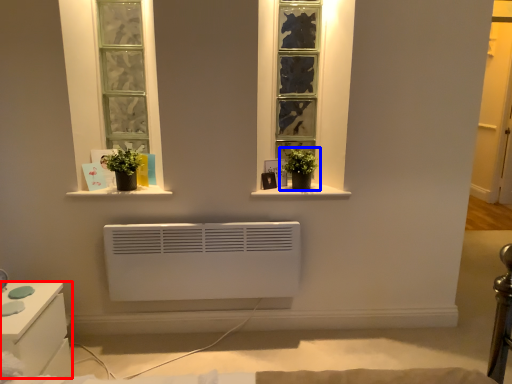
Question: Among these objects, which one is farthest to the camera, furniture (highlighted by a red box) or houseplant (highlighted by a blue box)?

Choices:
 (A) furniture
 (B) houseplant

Answer: (B)